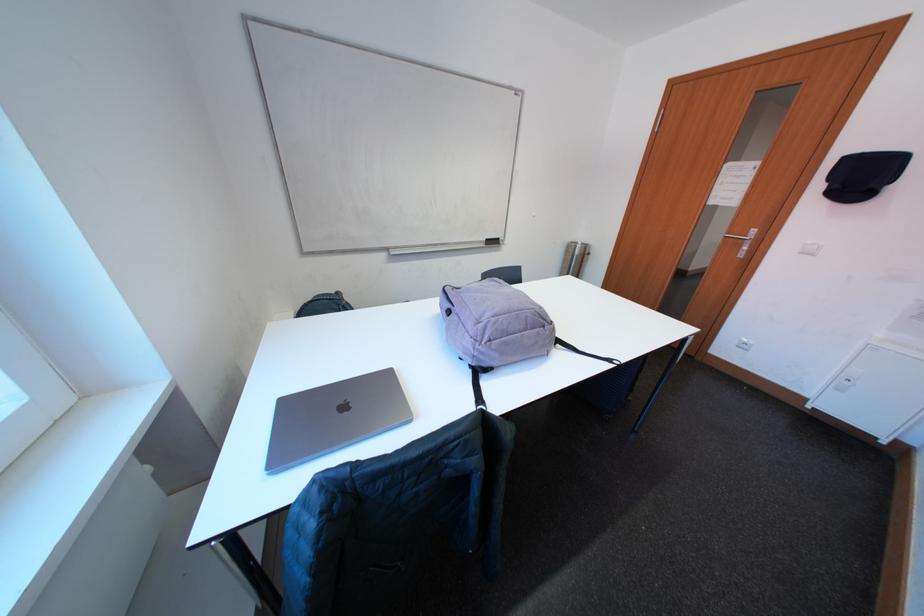
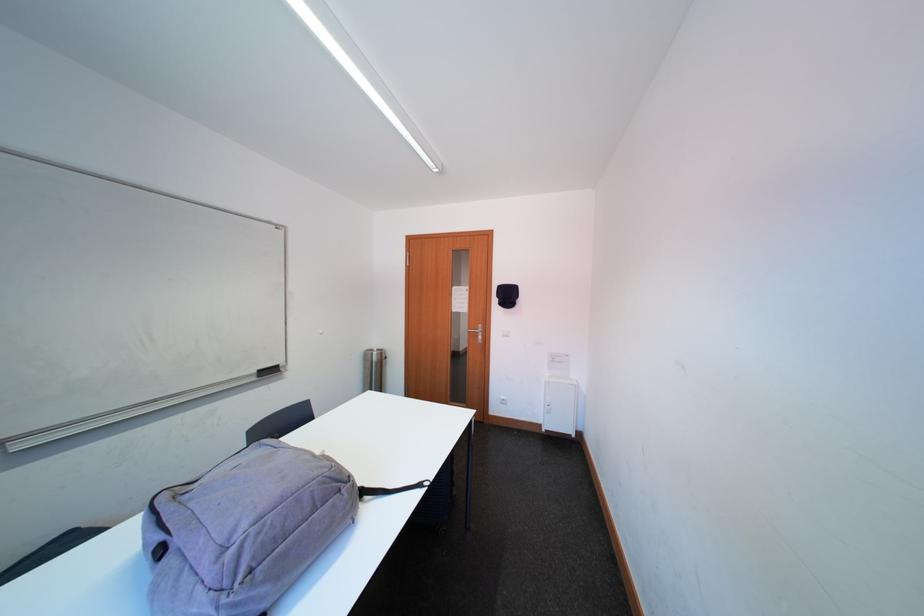
Find the pixel in the second image that matches [739,246] in the first image.

(481, 339)